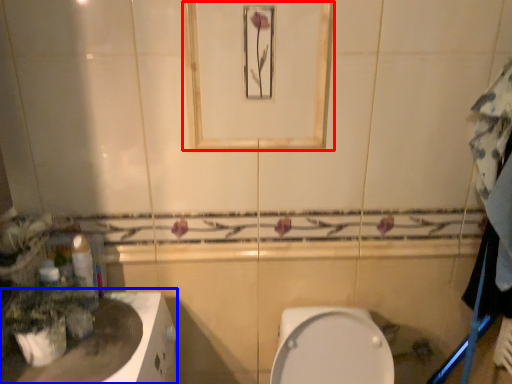
Question: Which object appears farthest to the camera in this image, mirror (highlighted by a red box) or counter top (highlighted by a blue box)?

Choices:
 (A) mirror
 (B) counter top

Answer: (A)